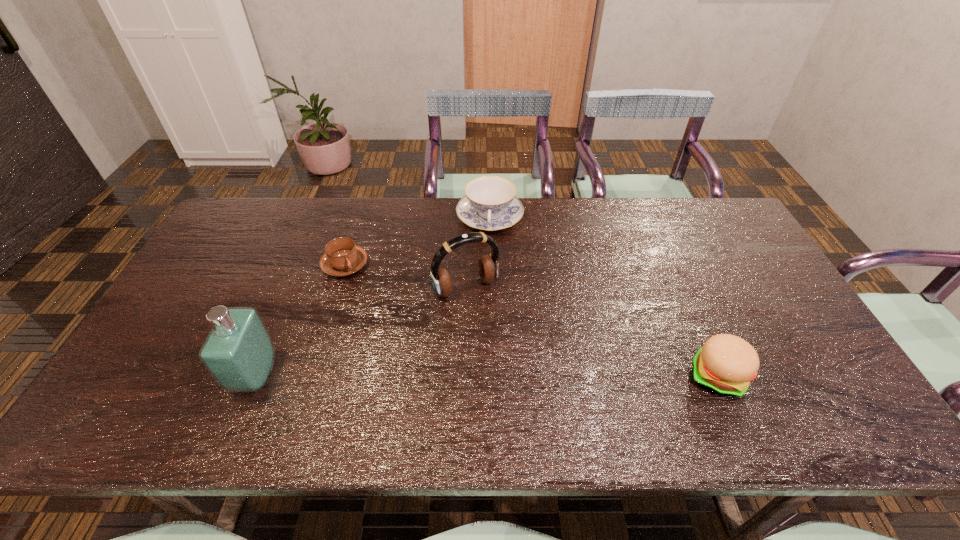
You are a GUI agent. You are given a task and a screenshot of the screen. Output one action in this format:
    pyautogui.click(x=<x>, y=<y>)
    Task: Click on the leftmost object
    Image resolution: width=960 pixels, height=540 pixels.
    Given the screenshot: What is the action you would take?
    pyautogui.click(x=239, y=353)

You are a GUI agent. You are given a task and a screenshot of the screen. Output one action in this format:
    pyautogui.click(x=<x>, y=<y>)
    Task: Click on the perfume
    This screenshot has width=960, height=540.
    Given the screenshot: What is the action you would take?
    pyautogui.click(x=239, y=353)

Find the location of a particular element. The height and width of the screenshot is (540, 960). the rightmost object is located at coordinates (725, 365).

Where is `headset`? headset is located at coordinates (488, 266).

Identify the location of the fourth object from right to left. (342, 257).

You are a GUI agent. You are given a task and a screenshot of the screen. Output one action in this format:
    pyautogui.click(x=<x>, y=<y>)
    Task: Click on the shortest object
    
    Given the screenshot: What is the action you would take?
    pyautogui.click(x=342, y=257)

At what (x,y) coordinates should I click in order to perform the action: click on chinaware. Please return your answer as a coordinate pair (x, y). Image resolution: width=960 pixels, height=540 pixels. Looking at the image, I should click on (490, 204).

Image resolution: width=960 pixels, height=540 pixels. What are the coordinates of `free spot located 0.070m on the front label of the leftmost object` in the screenshot? It's located at (209, 376).

Where is `vacant space situated 0.190m on the front label of the leftmost object`? vacant space situated 0.190m on the front label of the leftmost object is located at coordinates (160, 376).

This screenshot has height=540, width=960. In order to click on free space located 0.050m on the front label of the leftmost object in this screenshot , I will do `click(218, 376)`.